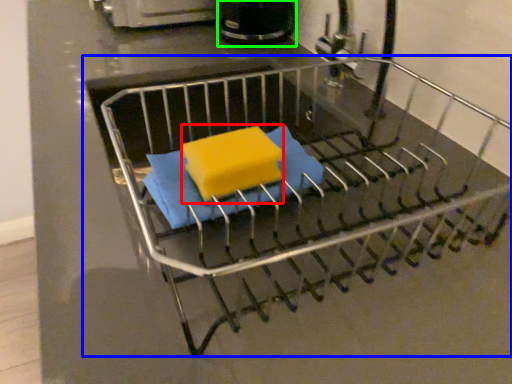
Question: Based on their relative distances, which object is nearer to cheese (highlighted by a red box)? Choose from furniture (highlighted by a blue box) and appliance (highlighted by a green box).

Choices:
 (A) furniture
 (B) appliance

Answer: (A)